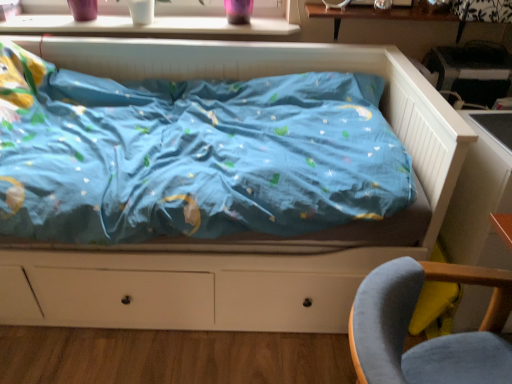
Question: Are velvet grey chair at lower right and white glossy window sill at upper center making contact?

Choices:
 (A) no
 (B) yes

Answer: (A)

Question: Does velvet grey chair at lower right appear on the left side of white glossy window sill at upper center?

Choices:
 (A) no
 (B) yes

Answer: (A)

Question: Is velvet grey chair at lower right far from white glossy window sill at upper center?

Choices:
 (A) no
 (B) yes

Answer: (B)

Question: Is velvet grey chair at lower right smaller than white glossy window sill at upper center?

Choices:
 (A) yes
 (B) no

Answer: (B)

Question: Is velvet grey chair at lower right completely or partially outside of white glossy window sill at upper center?

Choices:
 (A) no
 (B) yes

Answer: (B)

Question: Could you tell me if velvet grey chair at lower right is facing white glossy window sill at upper center?

Choices:
 (A) yes
 (B) no

Answer: (B)

Question: From the image's perspective, is white glossy window sill at upper center on top of velvet grey chair at lower right?

Choices:
 (A) no
 (B) yes

Answer: (B)

Question: From the image's perspective, would you say white glossy window sill at upper center is shown under velvet grey chair at lower right?

Choices:
 (A) yes
 (B) no

Answer: (B)

Question: Can you confirm if white glossy window sill at upper center is wider than velvet grey chair at lower right?

Choices:
 (A) no
 (B) yes

Answer: (A)

Question: Does white glossy window sill at upper center contain velvet grey chair at lower right?

Choices:
 (A) yes
 (B) no

Answer: (B)

Question: Is white glossy window sill at upper center far from velvet grey chair at lower right?

Choices:
 (A) yes
 (B) no

Answer: (A)

Question: Does white glossy window sill at upper center have a greater height compared to velvet grey chair at lower right?

Choices:
 (A) yes
 (B) no

Answer: (B)

Question: From the image's perspective, is velvet grey chair at lower right on matte blue bed at center?

Choices:
 (A) no
 (B) yes

Answer: (A)